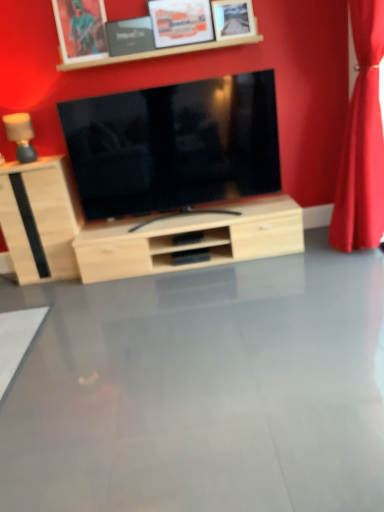
Where is `free area below matte wood lamp at left (from a real-world perspective)`? This screenshot has height=512, width=384. free area below matte wood lamp at left (from a real-world perspective) is located at coordinates (36, 159).